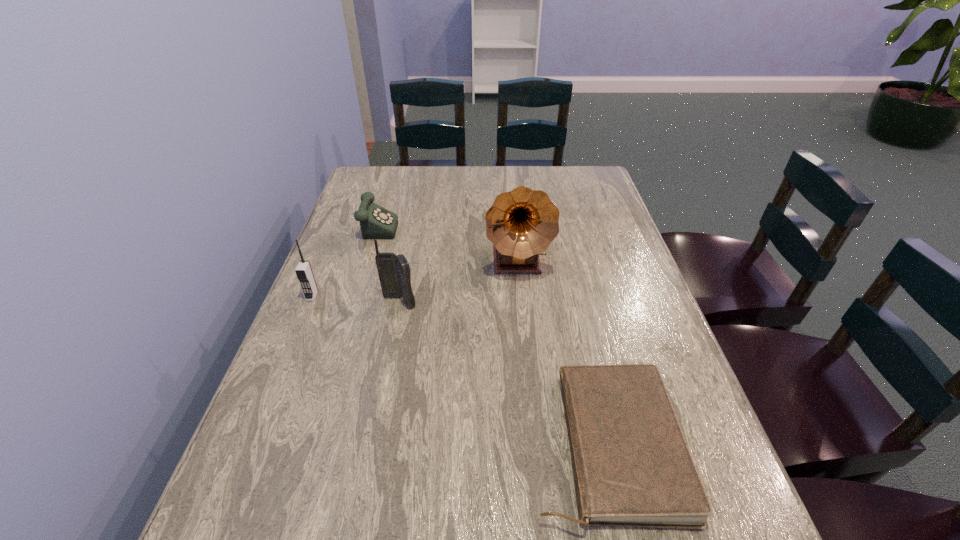
At what (x,y) coordinates should I click in order to perform the action: click on the tallest object. Please return your answer as a coordinate pair (x, y). The height and width of the screenshot is (540, 960). Looking at the image, I should click on (521, 224).

You are a GUI agent. You are given a task and a screenshot of the screen. Output one action in this format:
    pyautogui.click(x=<x>, y=<y>)
    Task: Click on the right cellular telephone
    
    Given the screenshot: What is the action you would take?
    pyautogui.click(x=394, y=272)

The image size is (960, 540). What are the coordinates of `the left cellular telephone` in the screenshot? It's located at (304, 273).

Where is `the fourth object from right to left`? the fourth object from right to left is located at coordinates click(x=376, y=222).

Locate an element on the screen. The width and height of the screenshot is (960, 540). the second shortest object is located at coordinates (376, 222).

This screenshot has width=960, height=540. In order to click on the nearest object in this screenshot , I will do `click(632, 467)`.

Locate an element on the screen. The height and width of the screenshot is (540, 960). paperback book is located at coordinates (632, 467).

Where is `vacant space located on the horn of the tallest object`? vacant space located on the horn of the tallest object is located at coordinates (525, 350).

Find the location of a particular element. Image resolution: width=960 pixels, height=540 pixels. free space located 0.370m on the keyboard of the right cellular telephone is located at coordinates (368, 463).

The height and width of the screenshot is (540, 960). I want to click on free space located on the front-facing side of the left cellular telephone, so click(x=250, y=446).